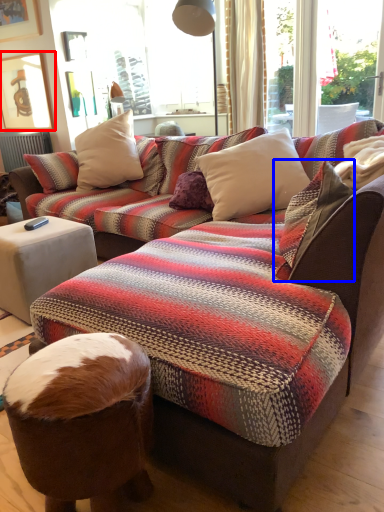
Question: Which object is further to the camera taking this photo, picture frame (highlighted by a red box) or pillow (highlighted by a blue box)?

Choices:
 (A) picture frame
 (B) pillow

Answer: (A)